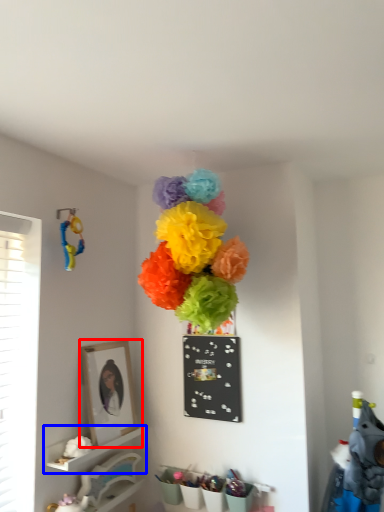
Question: Which object is further to the camera taking this photo, picture frame (highlighted by a red box) or shelf (highlighted by a blue box)?

Choices:
 (A) picture frame
 (B) shelf

Answer: (A)